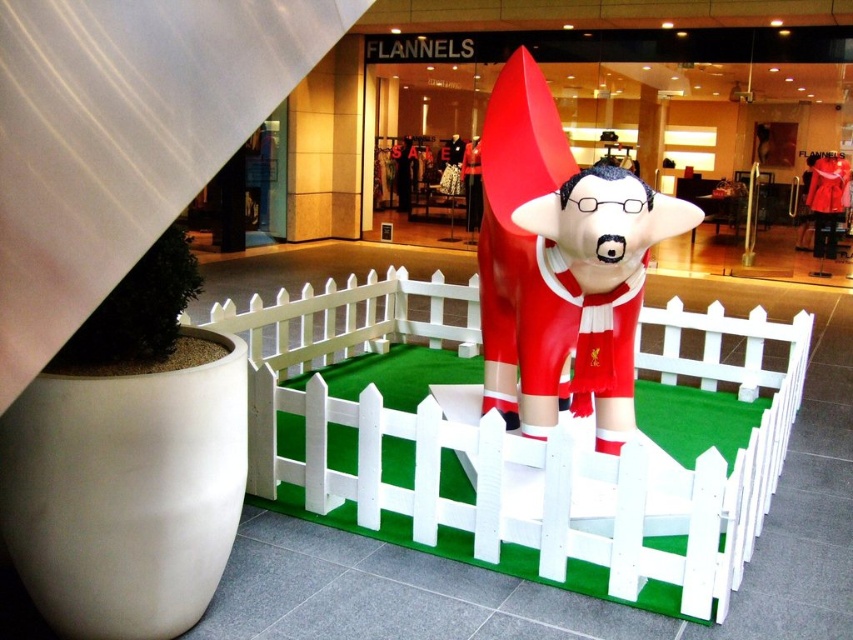
You are a maintenance worker in the mall and need to clean the shiny red statue at center. You have a 36 inch long cleaning pole. Can you reach the white plastic fence at center from the statue without moving the pole?

The distance between the white plastic fence at center and the shiny red statue at center is 38.29 inches. Since the cleaning pole is only 36 inches long, it is not long enough to reach the fence from the statue.

You are standing at the entrance of the mall and see two points marked in the scene. The first point is at coordinates point (270, 387) and the second point is at point (624, 419). Which point is closer to you?

Point (270, 387) is in front of point (624, 419), so the first point is closer to you.

You are a maintenance worker in the mall and need to move the shiny red statue at center to another location. The path you need to take is narrow and only allows objects up to the width of the white plastic fence at center. Can you move the statue through the path?

The white plastic fence at center is wider than the shiny red statue at center. Since the path allows objects up to the width of the white plastic fence at center, the statue can be moved through the path because its width is less than or equal to the fence.